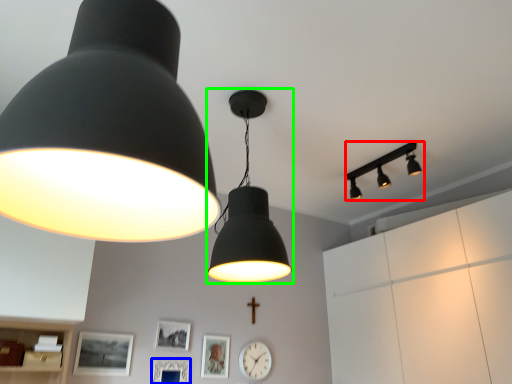
Question: Estimate the real-world distances between objects in this image. Which object is farther from lamp (highlighted by a red box), picture frame (highlighted by a blue box) or lamp (highlighted by a green box)?

Choices:
 (A) picture frame
 (B) lamp

Answer: (A)